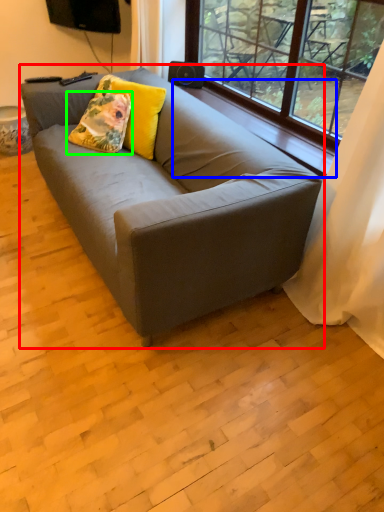
Question: Which is nearer to the studio couch (highlighted by a red box)? window sill (highlighted by a blue box) or throw pillow (highlighted by a green box).

Choices:
 (A) window sill
 (B) throw pillow

Answer: (B)